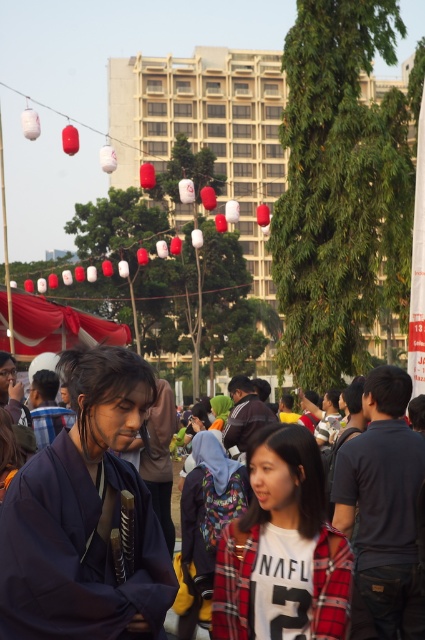
You are a photographer at the event and want to capture both the purple fabric kimono at center and the white cotton shirt at center in a single frame. Which clothing item should you focus on first to ensure both are in the frame?

The purple fabric kimono at center is taller than the white cotton shirt at center, so you should focus on the purple fabric kimono at center first to ensure both are in the frame.

You are standing in the center of the image and want to move towards the purple fabric kimono at center. In which direction should you move?

The purple fabric kimono at center is located at point 0.808 on the x axis and 0.202 on the y axis. Since you are at the center of the image, you should move towards the right and slightly downward to reach the purple fabric kimono at center.